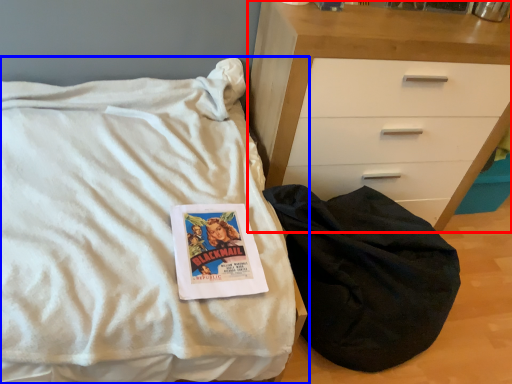
Question: Which object appears closest to the camera in this image, chest of drawers (highlighted by a red box) or bed (highlighted by a blue box)?

Choices:
 (A) chest of drawers
 (B) bed

Answer: (B)